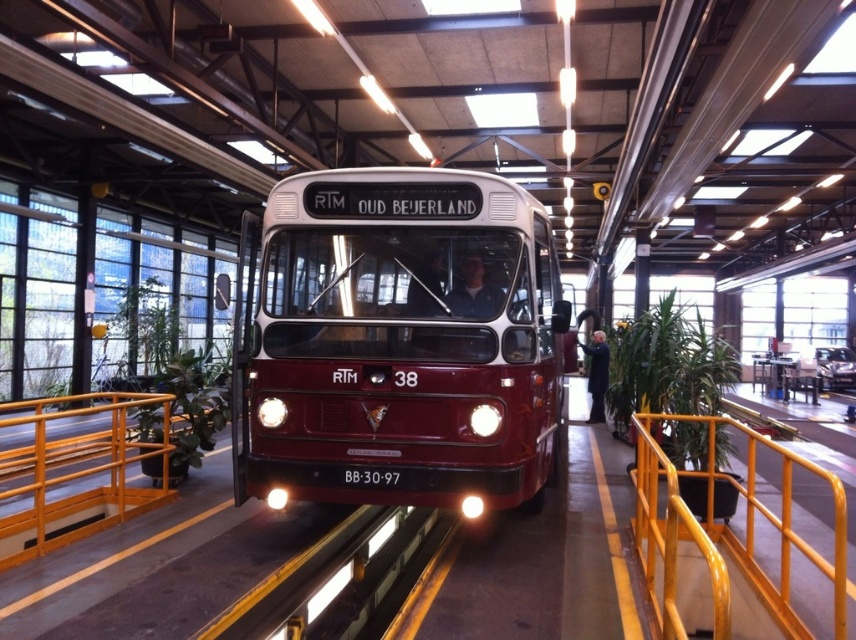
You are a visitor at the exhibition hall and want to walk around the vintage bus. You see the yellow metal railing at center and the yellow metal rail at lower left. Which one is larger in size?

The yellow metal railing at center is bigger than the yellow metal rail at lower left.

You are a tour guide giving a presentation about this vintage bus. Where exactly is the maroon matte bus at center located in the image?

The maroon matte bus at center is located at point (399, 342).

Consider the image. You are a visitor standing at the entrance of the hall and want to walk towards the vintage bus. Which direction should you move relative to the yellow metal rail at lower left and the yellow metal railing at center?

You should move to the right of the yellow metal rail at lower left and the yellow metal railing at center since the yellow metal railing at center is positioned to the right of the yellow metal rail at lower left.